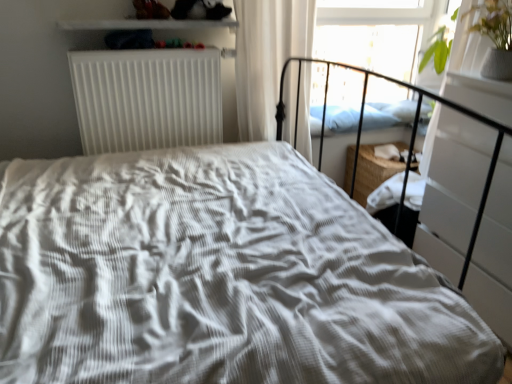
Measure the distance between white matte radiator at upper left and camera.

white matte radiator at upper left is 1.95 meters from camera.

Describe the element at coordinates (342, 118) in the screenshot. I see `blue soft pillow at upper right` at that location.

Identify the location of white glossy shelf at upper center. (144, 24).

From the picture: Which of these two, blue soft pillow at upper right or white glossy shelf at upper center, is bigger?

blue soft pillow at upper right.

Considering the sizes of blue soft pillow at upper right and white glossy shelf at upper center in the image, is blue soft pillow at upper right wider or thinner than white glossy shelf at upper center?

Considering their sizes, blue soft pillow at upper right looks broader than white glossy shelf at upper center.

Based on the photo, is blue soft pillow at upper right spatially inside white glossy shelf at upper center, or outside of it?

blue soft pillow at upper right is not enclosed by white glossy shelf at upper center.

Measure the distance between blue soft pillow at upper right and white glossy shelf at upper center.

blue soft pillow at upper right is 1.08 meters from white glossy shelf at upper center.

Is blue soft pillow at upper right further to camera compared to white matte radiator at upper left?

Yes, blue soft pillow at upper right is further from the viewer.

Does blue soft pillow at upper right touch white matte radiator at upper left?

No, blue soft pillow at upper right is not beside white matte radiator at upper left.

From the image's perspective, is blue soft pillow at upper right above white matte radiator at upper left?

Yes.

Do you think blue soft pillow at upper right is within white matte radiator at upper left, or outside of it?

blue soft pillow at upper right is located beyond the bounds of white matte radiator at upper left.

Between white matte radiator at upper left and white glossy shelf at upper center, which one is positioned behind?

white matte radiator at upper left is further away from the camera.

Which of these two, white matte radiator at upper left or white glossy shelf at upper center, is thinner?

white matte radiator at upper left is thinner.

Considering the positions of objects white matte radiator at upper left and white glossy shelf at upper center in the image provided, who is more to the left, white matte radiator at upper left or white glossy shelf at upper center?

white matte radiator at upper left is more to the left.

In the image, there is a white matte radiator at upper left. In order to click on window sill above it (from the image's perspective) in this screenshot , I will do `click(144, 24)`.

Between blue soft pillow at upper right and white sheer curtain at upper right, which one is positioned in front?

white sheer curtain at upper right.

Does blue soft pillow at upper right turn towards white sheer curtain at upper right?

No, blue soft pillow at upper right is not aimed at white sheer curtain at upper right.

From a real-world perspective, is blue soft pillow at upper right located higher than white sheer curtain at upper right?

No, from a real-world perspective, blue soft pillow at upper right is not over white sheer curtain at upper right

Is blue soft pillow at upper right positioned far away from white sheer curtain at upper right?

blue soft pillow at upper right is near white sheer curtain at upper right, not far away.

In terms of height, does white sheer curtain at upper right look taller or shorter compared to transparent glass window screen at upper right?

Clearly, white sheer curtain at upper right is taller compared to transparent glass window screen at upper right.

Can you confirm if white sheer curtain at upper right is smaller than transparent glass window screen at upper right?

Actually, white sheer curtain at upper right might be larger than transparent glass window screen at upper right.

Considering the positions of point (295, 67) and point (337, 85), is point (295, 67) closer or farther from the camera than point (337, 85)?

Point (295, 67) is closer to the camera than point (337, 85).

Is white sheer curtain at upper right wider or thinner than transparent glass window screen at upper right?

Considering their sizes, white sheer curtain at upper right looks broader than transparent glass window screen at upper right.

From the picture: Is white glossy shelf at upper center to the left or to the right of white matte radiator at upper left in the image?

In the image, white glossy shelf at upper center appears on the right side of white matte radiator at upper left.

Can you confirm if white glossy shelf at upper center is thinner than white matte radiator at upper left?

In fact, white glossy shelf at upper center might be wider than white matte radiator at upper left.

Does white glossy shelf at upper center have a greater height compared to white matte radiator at upper left?

No.

Which is behind, point (113, 28) or point (340, 131)?

Point (340, 131)

How many degrees apart are the facing directions of white glossy shelf at upper center and blue soft pillow at upper right?

They differ by 0.489 degrees in their facing directions.

From the image's perspective, which is above, white glossy shelf at upper center or blue soft pillow at upper right?

white glossy shelf at upper center.

In the image, there is a white glossy shelf at upper center. Where is `pillow below it (from a real-world perspective)`? The width and height of the screenshot is (512, 384). pillow below it (from a real-world perspective) is located at coordinates (342, 118).

This screenshot has height=384, width=512. I want to click on pillow located on the right of white matte radiator at upper left, so click(x=342, y=118).

From the image, which object appears to be farther from transparent glass window screen at upper right, white matte radiator at upper left or white glossy shelf at upper center?

Based on the image, white glossy shelf at upper center appears to be further to transparent glass window screen at upper right.

Looking at the image, which one is located closer to blue soft pillow at upper right, white sheer curtain at upper right or transparent glass window screen at upper right?

transparent glass window screen at upper right.

Looking at the image, which one is located further to white sheer curtain at upper right, white matte radiator at upper left or blue soft pillow at upper right?

blue soft pillow at upper right lies further to white sheer curtain at upper right than the other object.

Based on their spatial positions, is white glossy shelf at upper center or transparent glass window screen at upper right further from white sheer curtain at upper right?

transparent glass window screen at upper right.

Looking at the image, which one is located closer to transparent glass window screen at upper right, white matte radiator at upper left or blue soft pillow at upper right?

blue soft pillow at upper right lies closer to transparent glass window screen at upper right than the other object.

Based on their spatial positions, is blue soft pillow at upper right or transparent glass window screen at upper right closer to white glossy shelf at upper center?

blue soft pillow at upper right is closer to white glossy shelf at upper center.

Looking at the image, which one is located further to white sheer curtain at upper right, blue soft pillow at upper right or white glossy shelf at upper center?

blue soft pillow at upper right.

When comparing their distances from transparent glass window screen at upper right, does white sheer curtain at upper right or white glossy shelf at upper center seem closer?

white sheer curtain at upper right is closer to transparent glass window screen at upper right.

You are a GUI agent. You are given a task and a screenshot of the screen. Output one action in this format:
    pyautogui.click(x=<x>, y=<y>)
    Task: Click on the curtain between white glossy shelf at upper center and blue soft pillow at upper right from left to right
    
    Given the screenshot: What is the action you would take?
    pyautogui.click(x=267, y=58)

The width and height of the screenshot is (512, 384). What are the coordinates of `curtain between white matte radiator at upper left and transparent glass window screen at upper right from left to right` in the screenshot? It's located at (267, 58).

Where is `window sill between white matte radiator at upper left and white sheer curtain at upper right`? The image size is (512, 384). window sill between white matte radiator at upper left and white sheer curtain at upper right is located at coordinates (144, 24).

Find the location of a particular element. pillow positioned between white sheer curtain at upper right and transparent glass window screen at upper right from near to far is located at coordinates (342, 118).